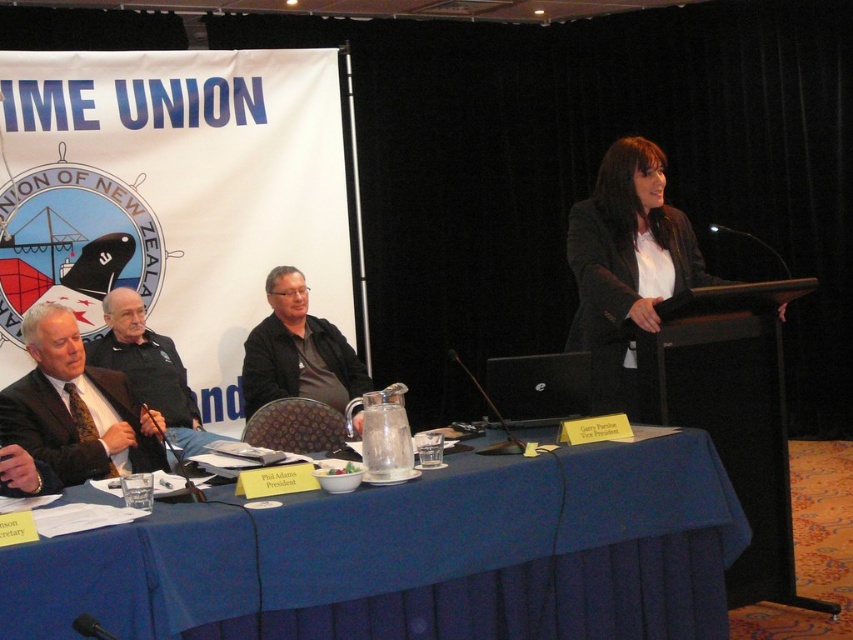
Question: Does white glossy blazer at center lie behind matte black suit at left?

Choices:
 (A) yes
 (B) no

Answer: (A)

Question: Does white glossy blazer at center appear on the left side of matte black suit at left?

Choices:
 (A) yes
 (B) no

Answer: (B)

Question: Which object is closer to the camera taking this photo?

Choices:
 (A) black leather jacket at center
 (B) matte black suit at left
 (C) blue fabric table at center
 (D) white glossy blazer at center

Answer: (C)

Question: Based on their relative distances, which object is nearer to the matte black suit at left?

Choices:
 (A) blue fabric table at center
 (B) black leather jacket at center

Answer: (A)

Question: Which object appears closest to the camera in this image?

Choices:
 (A) black leather jacket at center
 (B) dark suit at left

Answer: (B)

Question: Is blue fabric table at center to the right of black leather jacket at center from the viewer's perspective?

Choices:
 (A) yes
 (B) no

Answer: (A)